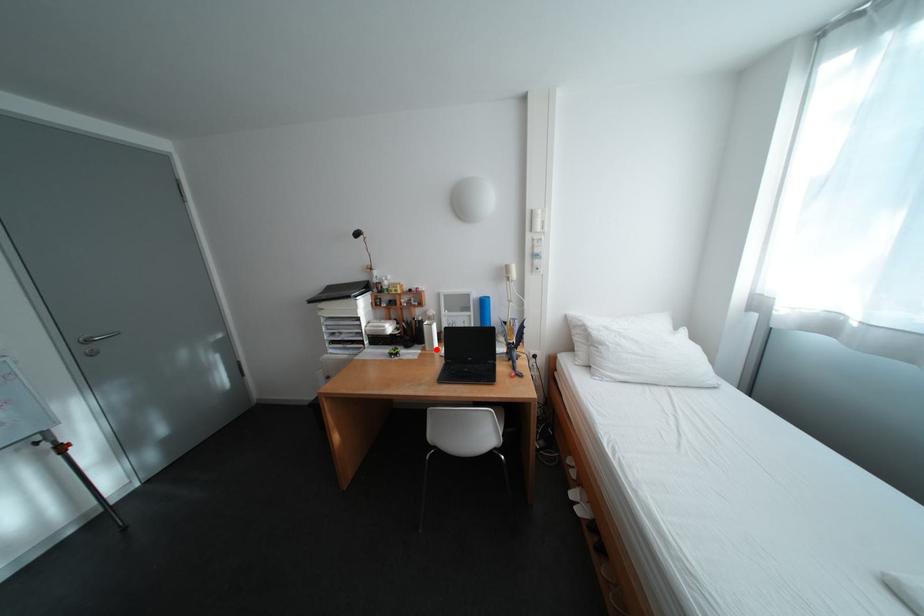
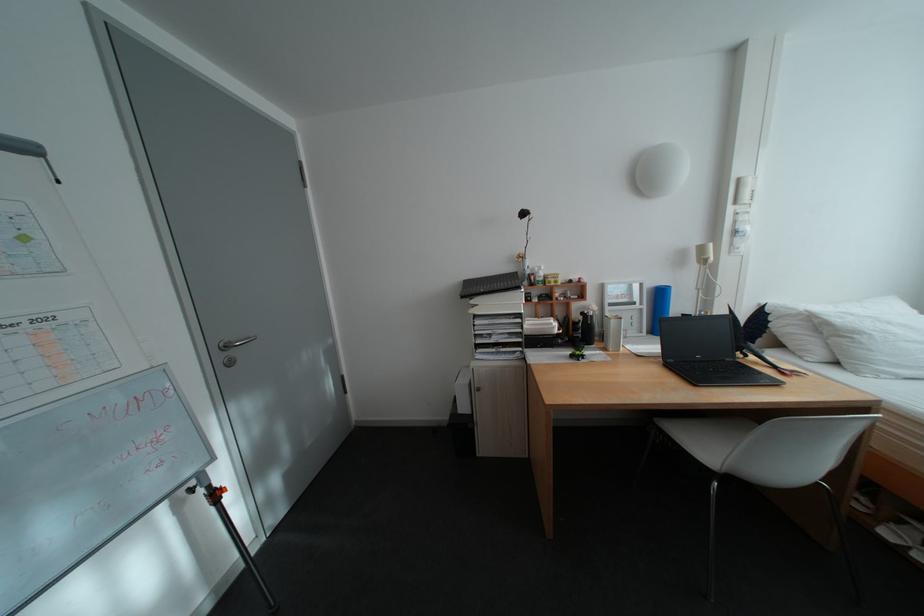
Locate, in the second image, the point that corresponds to the highlighted location in the first image.

(617, 350)